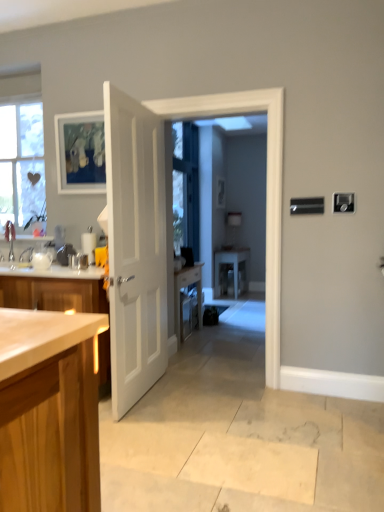
The width and height of the screenshot is (384, 512). In order to click on white glossy table at center in this screenshot , I will do `click(231, 271)`.

At what (x,y) coordinates should I click in order to perform the action: click on matte wooden picture frame at upper left. Please return your answer as a coordinate pair (x, y). Looking at the image, I should click on (80, 153).

Where is `clear glass window screen at center`? This screenshot has width=384, height=512. clear glass window screen at center is located at coordinates (185, 186).

Would you say clear glass window screen at center is a long distance from matte wooden picture frame at upper left?

That's right, there is a large distance between clear glass window screen at center and matte wooden picture frame at upper left.

Which is behind, clear glass window screen at center or matte wooden picture frame at upper left?

clear glass window screen at center is further from the camera.

Looking at this image, is clear glass window screen at center positioned with its back to matte wooden picture frame at upper left?

No, clear glass window screen at center is not facing away from matte wooden picture frame at upper left.

Could you tell me if matte wooden picture frame at upper left is facing white glossy table at center?

No, matte wooden picture frame at upper left is not aimed at white glossy table at center.

Locate an element on the screen. This screenshot has height=512, width=384. picture frame on the left side of white glossy table at center is located at coordinates (80, 153).

Is point (97, 178) positioned before point (224, 262)?

Yes.

Considering the relative sizes of matte wooden picture frame at upper left and white glossy table at center in the image provided, is matte wooden picture frame at upper left taller than white glossy table at center?

No, matte wooden picture frame at upper left is not taller than white glossy table at center.

From the image's perspective, between clear glass window screen at center and white glossy table at center, which one is located above?

clear glass window screen at center.

Does clear glass window screen at center turn towards white glossy table at center?

No, clear glass window screen at center is not facing towards white glossy table at center.

Is clear glass window screen at center not near white glossy table at center?

That's not correct — clear glass window screen at center is a little close to white glossy table at center.

In the scene shown: Is clear glass window screen at center at the back of white glossy table at center?

white glossy table at center is not turned away from clear glass window screen at center.

Can you confirm if white glossy table at center is wider than clear glass window screen at center?

Yes, white glossy table at center is wider than clear glass window screen at center.

Can you confirm if white glossy table at center is shorter than clear glass window screen at center?

Yes.

Considering the relative positions of white glossy table at center and clear glass window screen at center in the image provided, is white glossy table at center to the left or to the right of clear glass window screen at center?

white glossy table at center is positioned on clear glass window screen at center's right side.

Is white glossy door at center positioned in front of clear glass window screen at center?

Yes, white glossy door at center is closer to the camera.

Choose the correct answer: Is white glossy door at center inside clear glass window screen at center or outside it?

white glossy door at center is not enclosed by clear glass window screen at center.

Is white glossy door at center oriented towards clear glass window screen at center?

No.

From the image's perspective, which is below, white glossy door at center or clear glass window screen at center?

white glossy door at center.

Can you confirm if white matte door at center is taller than white glossy door at center?

No, white matte door at center is not taller than white glossy door at center.

Would you consider white matte door at center to be distant from white glossy door at center?

No, white matte door at center is in close proximity to white glossy door at center.

From the image's perspective, is white matte door at center over white glossy door at center?

No.

Considering the relative sizes of white matte door at center and white glossy door at center in the image provided, is white matte door at center wider than white glossy door at center?

No.

Which object is further away from the camera taking this photo, white glossy door at center or white glossy table at center?

white glossy table at center is behind.

From a real-world perspective, is white glossy door at center beneath white glossy table at center?

No.

This screenshot has width=384, height=512. I want to click on window screen below the matte wooden picture frame at upper left (from a real-world perspective), so click(185, 186).

Where is `picture frame on the left of white glossy table at center`? The height and width of the screenshot is (512, 384). picture frame on the left of white glossy table at center is located at coordinates (80, 153).

Looking at the image, which one is located closer to white glossy door at center, clear glass window screen at center or white glossy table at center?

clear glass window screen at center lies closer to white glossy door at center than the other object.

Which object lies further to the anchor point white glossy door at center, white matte door at center or white glossy table at center?

white glossy table at center is positioned further to the anchor white glossy door at center.

Considering their positions, is white glossy table at center positioned closer to matte wooden picture frame at upper left than white matte door at center?

white matte door at center.

From the image, which object appears to be nearer to white matte door at center, white glossy door at center or clear glass window screen at center?

Among the two, white glossy door at center is located nearer to white matte door at center.

Which object lies nearer to the anchor point white matte door at center, clear glass window screen at center or white glossy table at center?

Among the two, clear glass window screen at center is located nearer to white matte door at center.

Which object lies nearer to the anchor point white matte door at center, white glossy table at center or clear glass window screen at center?

The object closer to white matte door at center is clear glass window screen at center.

Based on their spatial positions, is white glossy table at center or white glossy door at center further from clear glass window screen at center?

white glossy door at center.

Estimate the real-world distances between objects in this image. Which object is closer to white matte door at center, white glossy door at center or matte wooden picture frame at upper left?

white glossy door at center is positioned closer to the anchor white matte door at center.

Find the location of a particular element. This screenshot has width=384, height=512. picture frame between white matte door at center and clear glass window screen at center along the z-axis is located at coordinates (80, 153).

This screenshot has width=384, height=512. I want to click on picture frame located between white glossy door at center and clear glass window screen at center in the depth direction, so click(80, 153).

Find the location of a particular element. Image resolution: width=384 pixels, height=512 pixels. screen door between white matte door at center and clear glass window screen at center in the front-back direction is located at coordinates (169, 226).

Where is `window screen between white glossy door at center and white glossy table at center along the z-axis`? This screenshot has width=384, height=512. window screen between white glossy door at center and white glossy table at center along the z-axis is located at coordinates (185, 186).